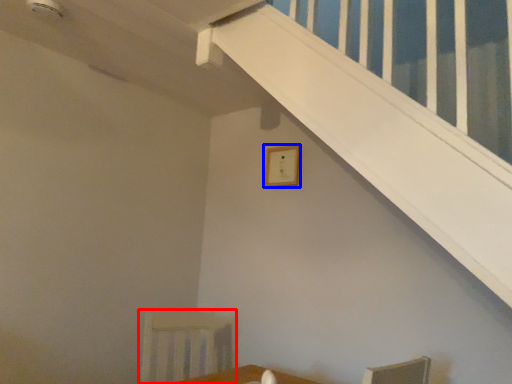
Question: Which of the following is the farthest to the observer, armchair (highlighted by a red box) or picture frame (highlighted by a blue box)?

Choices:
 (A) armchair
 (B) picture frame

Answer: (B)